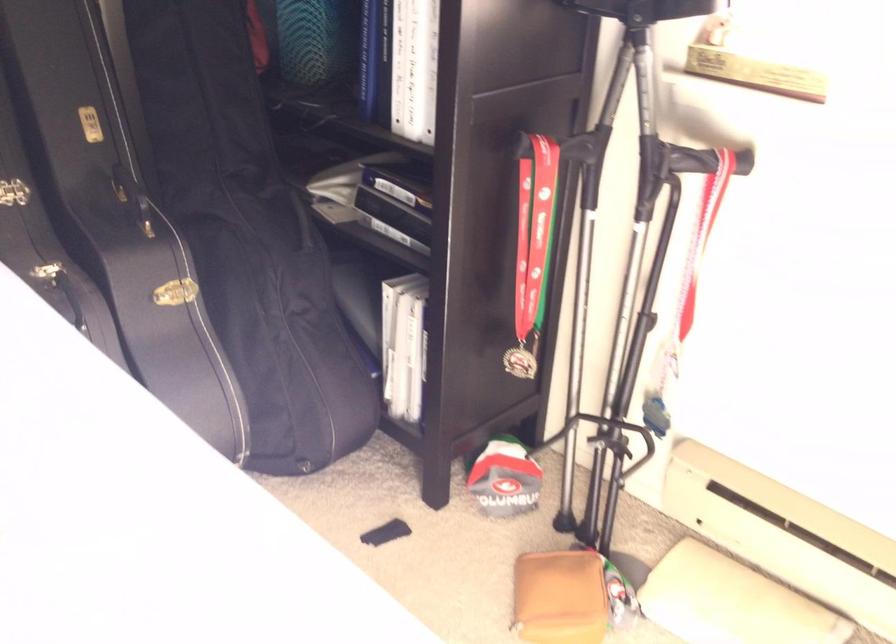
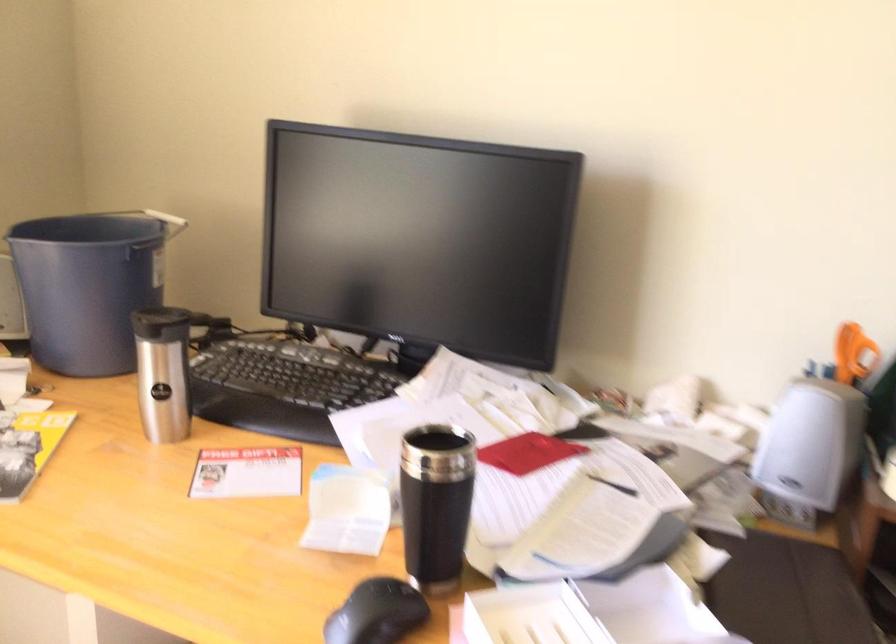
The first image is from the beginning of the video and the second image is from the end. How did the camera likely rotate when shooting the video?

The rotation direction of the camera is right-down.